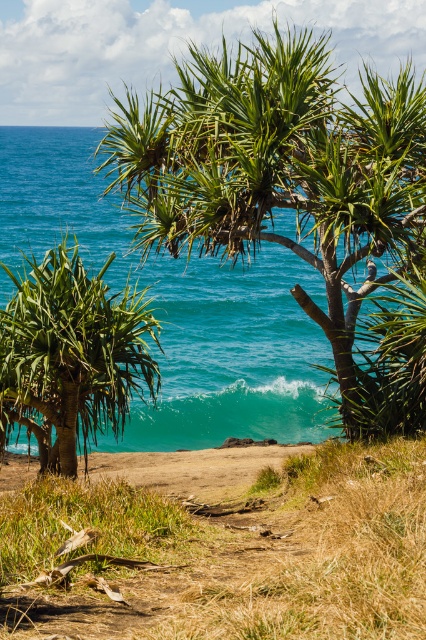
You are standing on the beach and want to take a photo of the green leafy palm tree at center without the teal glossy water at center in the background. Is this possible given their positions?

The green leafy palm tree at center is behind the teal glossy water at center, so it would be difficult to take a photo of the green leafy palm tree at center without the teal glossy water at center in the background because the water is in front of the tree.

You are a photographer standing at the edge of the grassy area. You want to capture both the teal glossy water at center and the green leafy palm tree at center in your shot. Which object will occupy more horizontal space in your photo?

The teal glossy water at center will occupy more horizontal space in your photo because its width surpasses that of the green leafy palm tree at center.